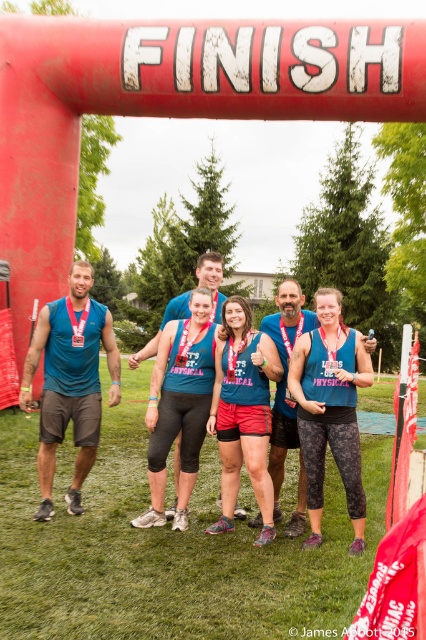
In the scene shown: Can you confirm if teal fabric tank top at center is thinner than matte teal tank top at center?

Indeed, teal fabric tank top at center has a lesser width compared to matte teal tank top at center.

What do you see at coordinates (242, 412) in the screenshot?
I see `teal fabric tank top at center` at bounding box center [242, 412].

At what (x,y) coordinates should I click in order to perform the action: click on teal fabric tank top at center. Please return your answer as a coordinate pair (x, y). Looking at the image, I should click on (242, 412).

At what (x,y) coordinates should I click in order to perform the action: click on teal fabric tank top at center. Please return your answer as a coordinate pair (x, y). This screenshot has height=640, width=426. Looking at the image, I should click on (242, 412).

Describe the element at coordinates (69, 381) in the screenshot. I see `matte blue tank top at left` at that location.

What are the coordinates of `matte blue tank top at left` in the screenshot? It's located at (69, 381).

Is blue fabric tank top at center shorter than matte teal tank top at center?

Incorrect, blue fabric tank top at center's height does not fall short of matte teal tank top at center's.

Which is behind, point (299, 426) or point (157, 435)?

The point (157, 435) is behind.

At what (x,y) coordinates should I click in order to perform the action: click on blue fabric tank top at center. Please return your answer as a coordinate pair (x, y). Looking at the image, I should click on (330, 410).